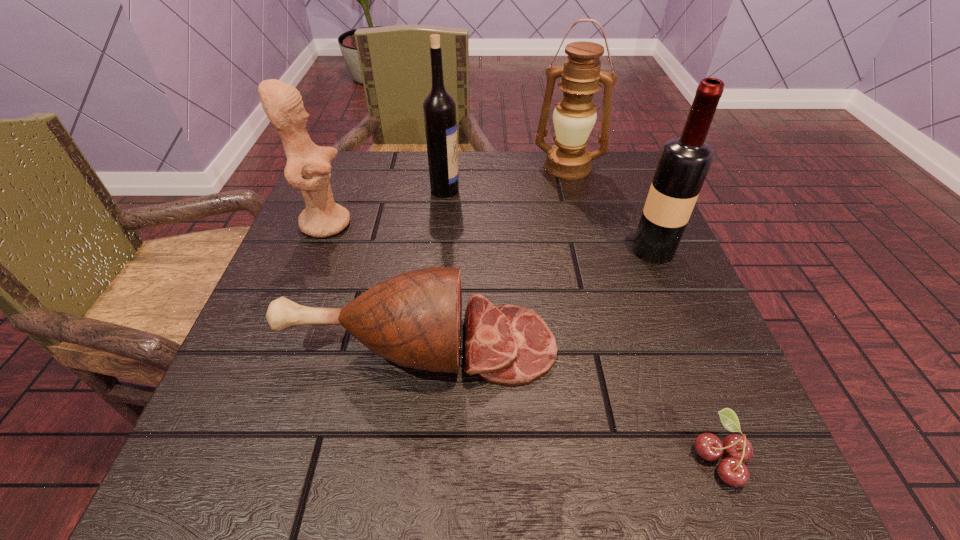
In order to click on vacant space situated 0.290m on the label of the left wine bottle in this screenshot , I will do `click(588, 190)`.

What are the coordinates of `blank space located 0.350m on the left of the nearer wine bottle` in the screenshot? It's located at (450, 250).

In order to click on vacant space located 0.290m on the front-facing side of the figurine in this screenshot , I will do pos(492,223).

Where is `vacant space located 0.200m at the sliced end of the ham`? This screenshot has width=960, height=540. vacant space located 0.200m at the sliced end of the ham is located at coordinates (684, 346).

Locate an element on the screen. The image size is (960, 540). vacant region located on the leaves of the cherry is located at coordinates (614, 457).

At what (x,y) coordinates should I click in order to perform the action: click on free region located on the leaves of the cherry. Please return your answer as a coordinate pair (x, y). This screenshot has width=960, height=540. Looking at the image, I should click on (623, 457).

Find the location of `vacant space located on the leaves of the cherry`. vacant space located on the leaves of the cherry is located at coordinates (435, 457).

The height and width of the screenshot is (540, 960). I want to click on oil lamp that is at the far edge, so click(575, 115).

At what (x,y) coordinates should I click in order to perform the action: click on wine bottle that is at the far edge. Please return your answer as a coordinate pair (x, y). The height and width of the screenshot is (540, 960). Looking at the image, I should click on (439, 108).

Where is `figurine present at the far edge`? Image resolution: width=960 pixels, height=540 pixels. figurine present at the far edge is located at coordinates (308, 166).